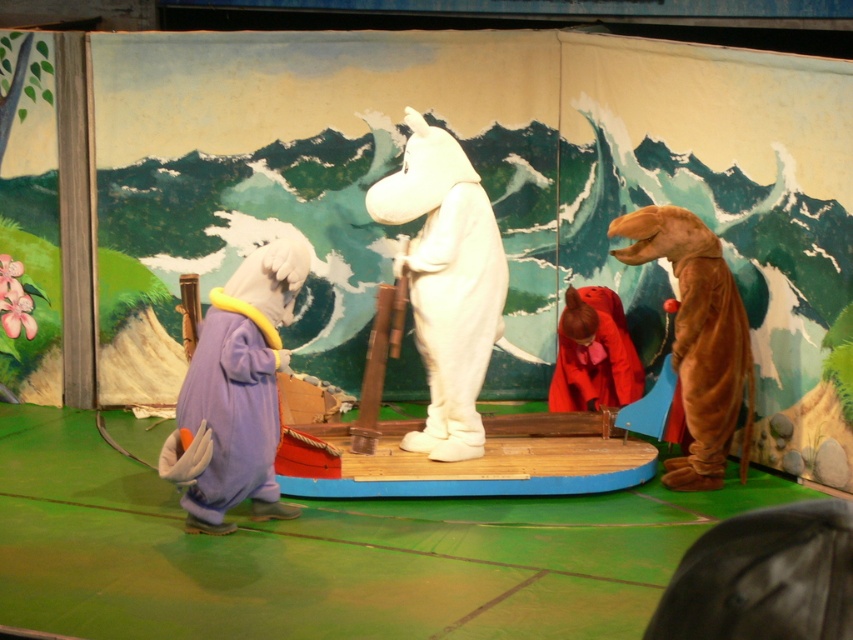
Is point (711, 301) more distant than point (604, 394)?

No, it is not.

I want to click on brown furry dinosaur at right, so click(698, 339).

Is white plush unicorn at center taller than purple plush elephant at left?

Yes.

Is point (451, 147) positioned in front of point (242, 465)?

No, it is behind (242, 465).

This screenshot has height=640, width=853. What are the coordinates of `white plush unicorn at center` in the screenshot? It's located at (445, 282).

Who is higher up, purple plush elephant at left or brown furry dinosaur at right?

brown furry dinosaur at right

Which is below, purple plush elephant at left or brown furry dinosaur at right?

purple plush elephant at left is lower down.

Identify the location of purple plush elephant at left. (236, 392).